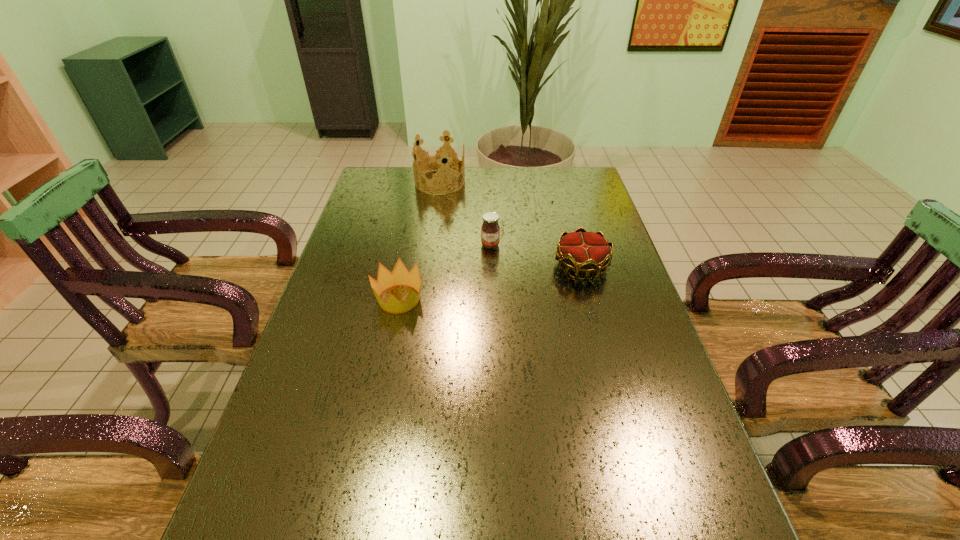
I want to click on crown that is the second closest one to the rightmost crown, so click(x=438, y=161).